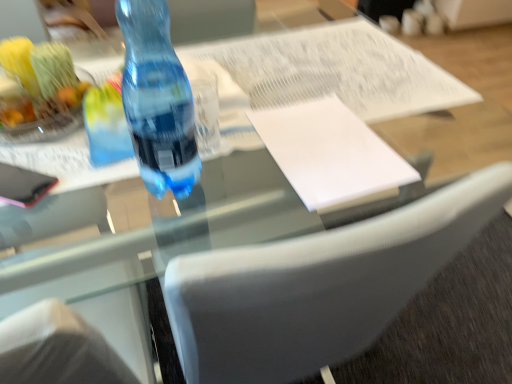
Image resolution: width=512 pixels, height=384 pixels. Identify the location of free space to the left of transparent plastic bottle at center. (88, 149).